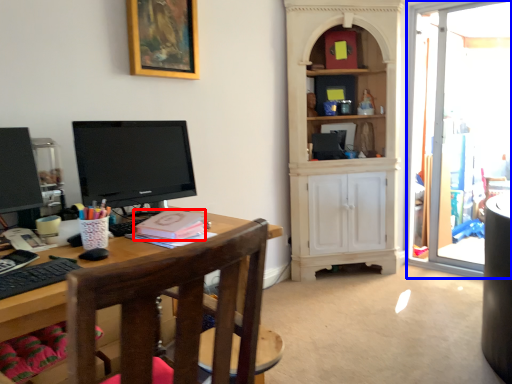
Question: Which point is closer to the camera, book (highlighted by a red box) or glass door (highlighted by a blue box)?

Choices:
 (A) book
 (B) glass door

Answer: (A)